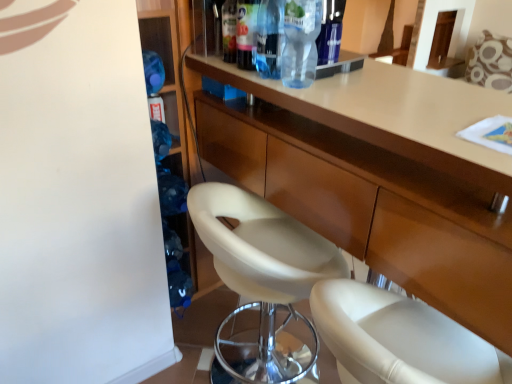
The width and height of the screenshot is (512, 384). I want to click on free space in front of transparent plastic bottle at upper center, positioned as the 2th bottle in right-to-left order, so click(368, 102).